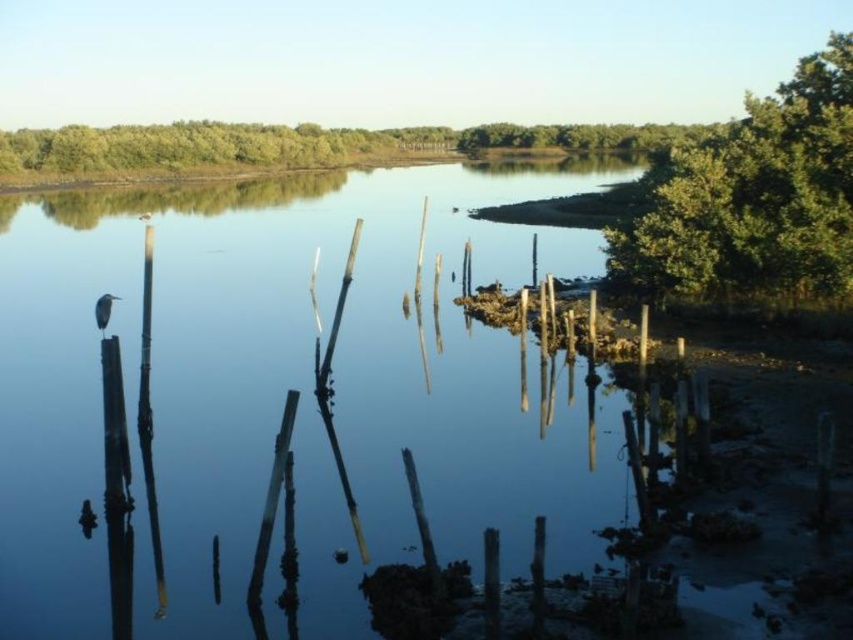
You are standing at the lakeside and want to reach the point marked as point (184, 272). Given that the average walking distance for an adult is about 3 feet per step, approximately how many steps would you need to take to reach that point?

The point (184, 272) is 118.88 feet away from the viewer. Since an adult takes about 3 feet per step, dividing 118.88 by 3 gives approximately 39.6 steps. Rounding up, you would need about 40 steps to reach the point.

You are a park ranger standing at the edge of the lakeside. You need to place a sign that must be exactly 12 meters away from the green leafy tree at upper right. Can you place the sign on the smooth water at center?

The smooth water at center is 11.75 meters away from the green leafy tree at upper right. Since the required distance is 12 meters, the sign placed on the smooth water at center would be 0.25 meters too close, so it cannot be placed there.

You are standing at the edge of the lakeside and want to find the smooth water at center. According to the coordinates provided, where should you look relative to your position?

The smooth water at center is located at coordinates point (285, 392), so you should look towards the lower right direction from your current position at the edge.